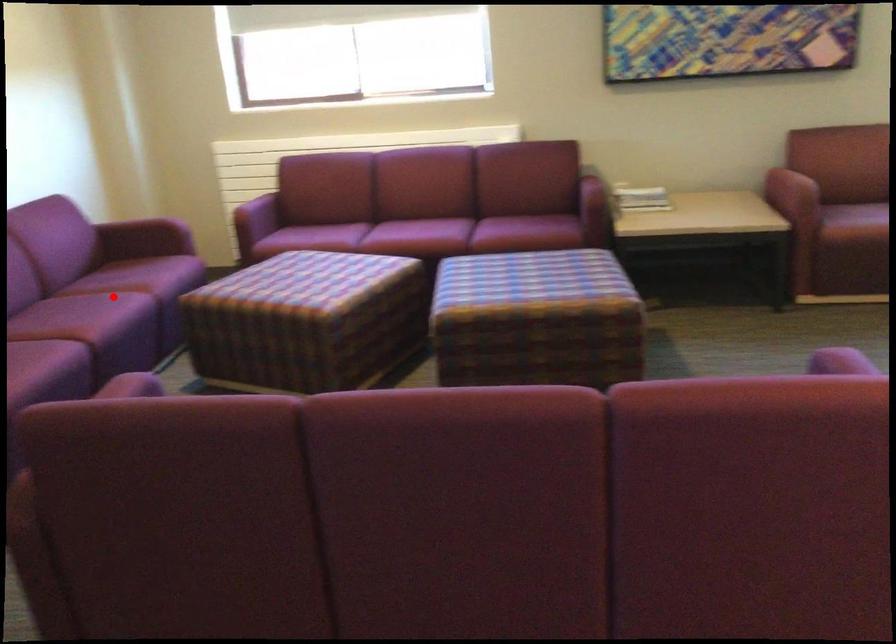
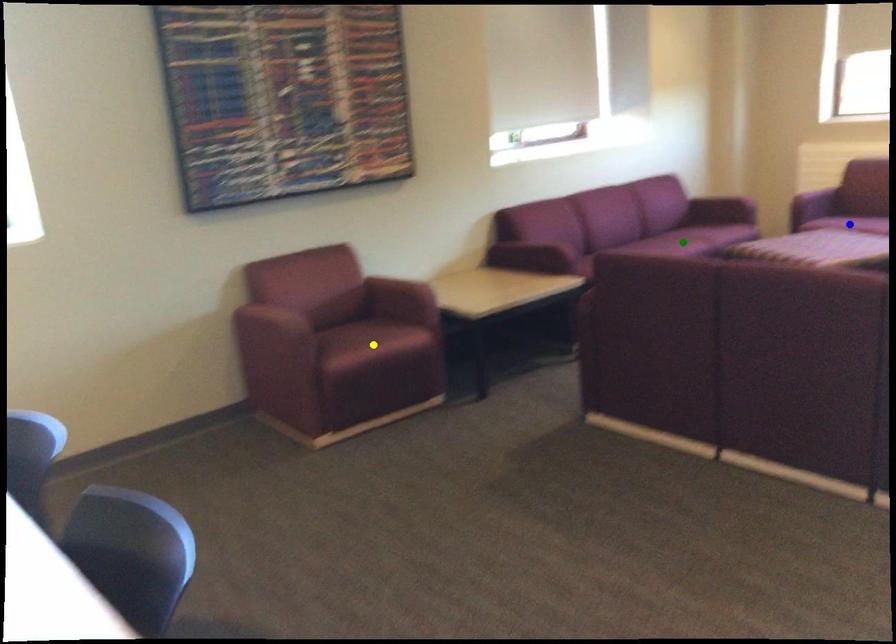
Question: I am providing you with two images of the same scene from different viewpoints. A red point is marked on the first image. You are given multiple points on the second image. Which spot in image 2 lines up with the point in image 1?

Choices:
 (A) yellow point
 (B) green point
 (C) blue point

Answer: (B)